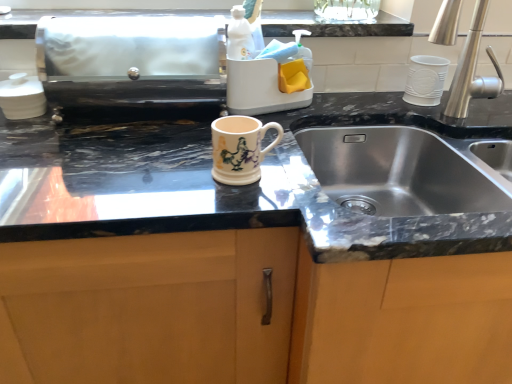
In order to face white glossy sink at upper center, should I rotate leftwards or rightwards?

You should rotate left by 6.989 degrees.

Identify the location of matte ceramic mug at center. (240, 148).

From the picture: Considering the relative sizes of matte ceramic mug at center and silver metallic faucet at right in the image provided, is matte ceramic mug at center wider than silver metallic faucet at right?

In fact, matte ceramic mug at center might be narrower than silver metallic faucet at right.

Would you say matte ceramic mug at center is to the left or to the right of silver metallic faucet at right in the picture?

In the image, matte ceramic mug at center appears on the left side of silver metallic faucet at right.

Is there a large distance between matte ceramic mug at center and silver metallic faucet at right?

No, matte ceramic mug at center is not far from silver metallic faucet at right.

Which object is positioned more to the left, white glossy sink at upper center or silver metallic faucet at right?

white glossy sink at upper center is more to the left.

Considering the positions of point (267, 17) and point (457, 103), is point (267, 17) closer or farther from the camera than point (457, 103)?

Point (267, 17) appears to be farther away from the viewer than point (457, 103).

Which is behind, white glossy sink at upper center or silver metallic faucet at right?

white glossy sink at upper center.

Which of these two, silver metallic faucet at right or white glossy sink at upper center, is wider?

silver metallic faucet at right is wider.

Is silver metallic faucet at right outside of white glossy sink at upper center?

silver metallic faucet at right lies outside white glossy sink at upper center's area.

Considering the sizes of objects silver metallic faucet at right and white glossy sink at upper center in the image provided, who is bigger, silver metallic faucet at right or white glossy sink at upper center?

silver metallic faucet at right is bigger.

Is white glossy sink at upper center wider than matte ceramic mug at center?

Indeed, white glossy sink at upper center has a greater width compared to matte ceramic mug at center.

From a real-world perspective, who is located higher, white glossy sink at upper center or matte ceramic mug at center?

white glossy sink at upper center is physically above.

Which object is positioned more to the left, white glossy sink at upper center or matte ceramic mug at center?

From the viewer's perspective, white glossy sink at upper center appears more on the left side.

Is matte ceramic mug at center completely or partially inside white glossy sink at upper center?

Actually, matte ceramic mug at center is outside white glossy sink at upper center.

Does point (488, 81) come closer to viewer compared to point (247, 131)?

That is False.

Which of these two, silver metallic faucet at right or matte ceramic mug at center, is smaller?

matte ceramic mug at center.

Is silver metallic faucet at right further to the viewer compared to matte ceramic mug at center?

Yes, silver metallic faucet at right is further from the viewer.

Who is taller, silver metallic faucet at right or matte ceramic mug at center?

With more height is silver metallic faucet at right.

From a real-world perspective, is matte ceramic mug at center beneath white glossy sink at upper center?

Correct, in the physical world, matte ceramic mug at center is lower than white glossy sink at upper center.

From the image's perspective, is matte ceramic mug at center located beneath white glossy sink at upper center?

Correct, matte ceramic mug at center appears lower than white glossy sink at upper center in the image.

Is matte ceramic mug at center with white glossy sink at upper center?

matte ceramic mug at center is not next to white glossy sink at upper center, and they're not touching.

The image size is (512, 384). I want to click on mug that appears below the silver metallic faucet at right (from the image's perspective), so click(240, 148).

You are a GUI agent. You are given a task and a screenshot of the screen. Output one action in this format:
    pyautogui.click(x=<x>, y=<y>)
    Task: Click on the countertop above the silver metallic faucet at right (from the image's perspective)
    
    Given the screenshot: What is the action you would take?
    pyautogui.click(x=332, y=25)

From the image, which object appears to be nearer to silver metallic faucet at right, white glossy sink at upper center or matte ceramic mug at center?

white glossy sink at upper center is positioned closer to the anchor silver metallic faucet at right.

Estimate the real-world distances between objects in this image. Which object is further from white glossy sink at upper center, matte ceramic mug at center or silver metallic faucet at right?

matte ceramic mug at center is positioned further to the anchor white glossy sink at upper center.

Considering their positions, is white glossy sink at upper center positioned closer to matte ceramic mug at center than silver metallic faucet at right?

white glossy sink at upper center.

Looking at the image, which one is located closer to silver metallic faucet at right, matte ceramic mug at center or white glossy sink at upper center?

Among the two, white glossy sink at upper center is located nearer to silver metallic faucet at right.

When comparing their distances from matte ceramic mug at center, does silver metallic faucet at right or white glossy sink at upper center seem closer?

white glossy sink at upper center lies closer to matte ceramic mug at center than the other object.

From the image, which object appears to be nearer to white glossy sink at upper center, silver metallic faucet at right or matte ceramic mug at center?

The object closer to white glossy sink at upper center is silver metallic faucet at right.

Where is `mug located between white glossy sink at upper center and silver metallic faucet at right in the left-right direction`? The width and height of the screenshot is (512, 384). mug located between white glossy sink at upper center and silver metallic faucet at right in the left-right direction is located at coordinates (240, 148).